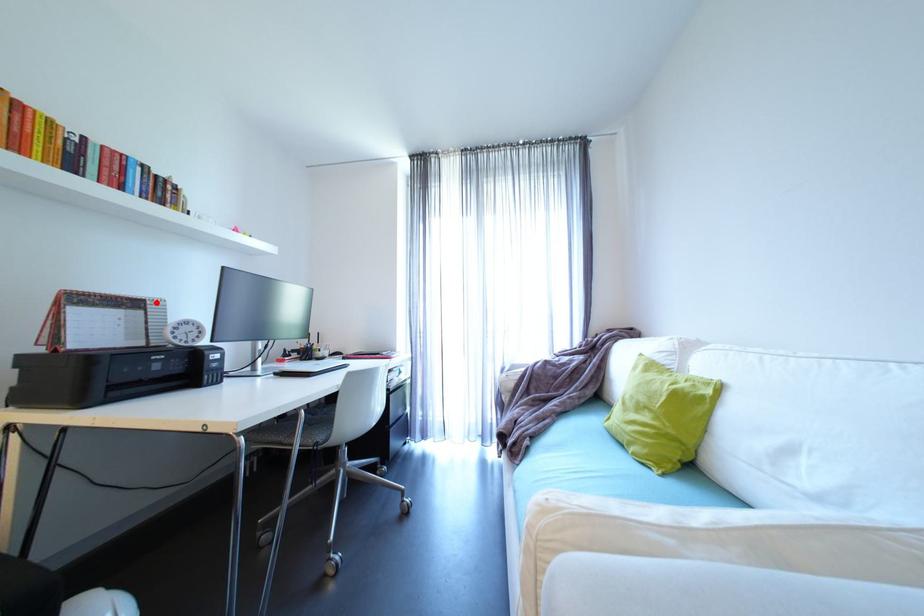
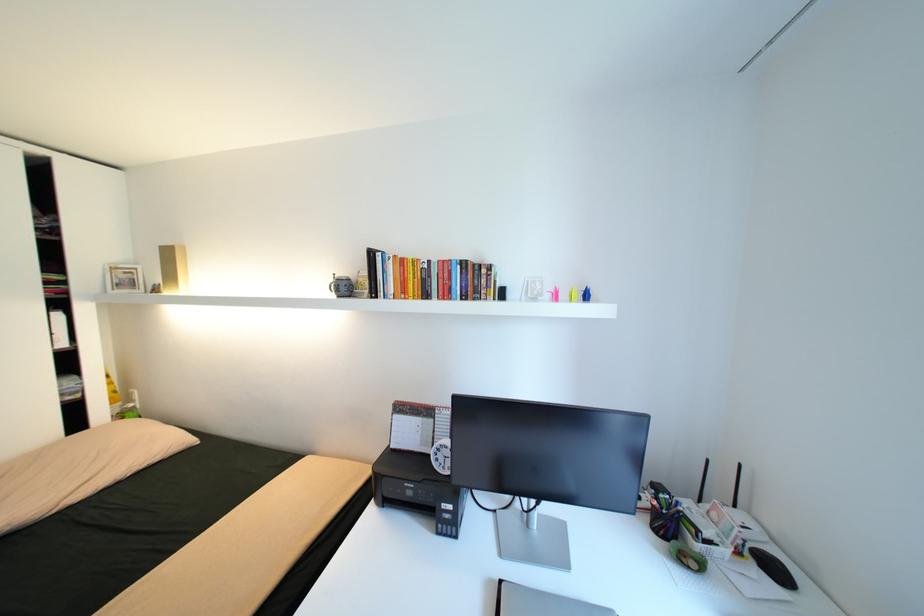
In the second image, find the point that corresponds to the highlighted location in the first image.

(444, 411)